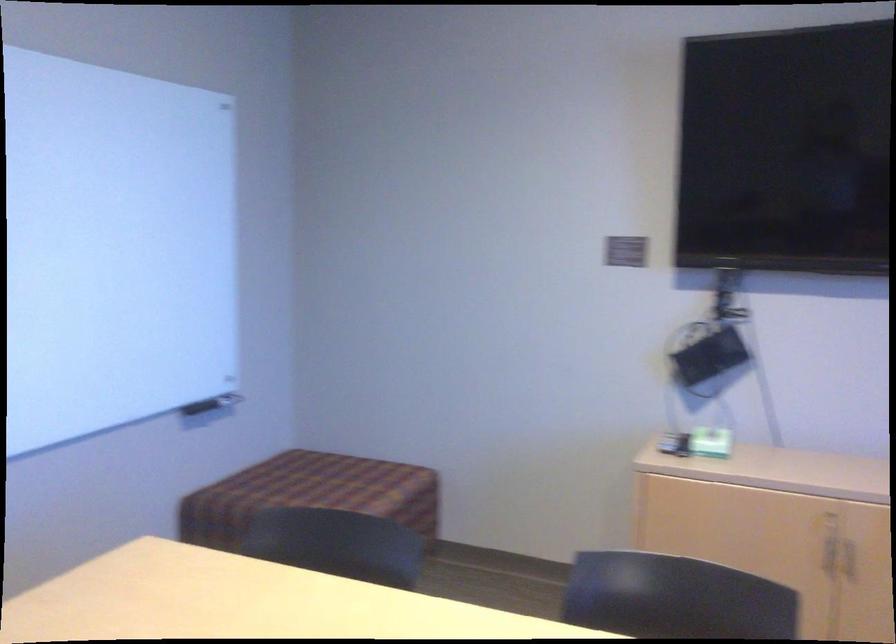
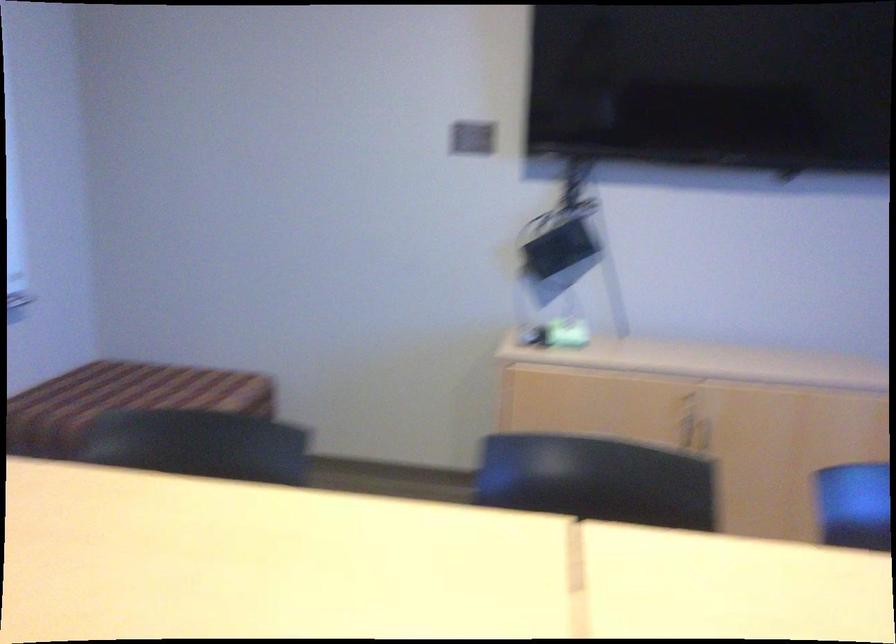
The images are taken continuously from a first-person perspective. In which direction are you moving?

The movement direction of the cameraman is left, forward.